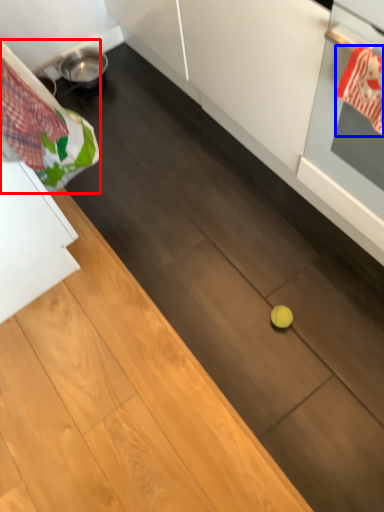
Question: Which object appears closest to the camera in this image, laundry (highlighted by a red box) or material (highlighted by a blue box)?

Choices:
 (A) laundry
 (B) material

Answer: (A)